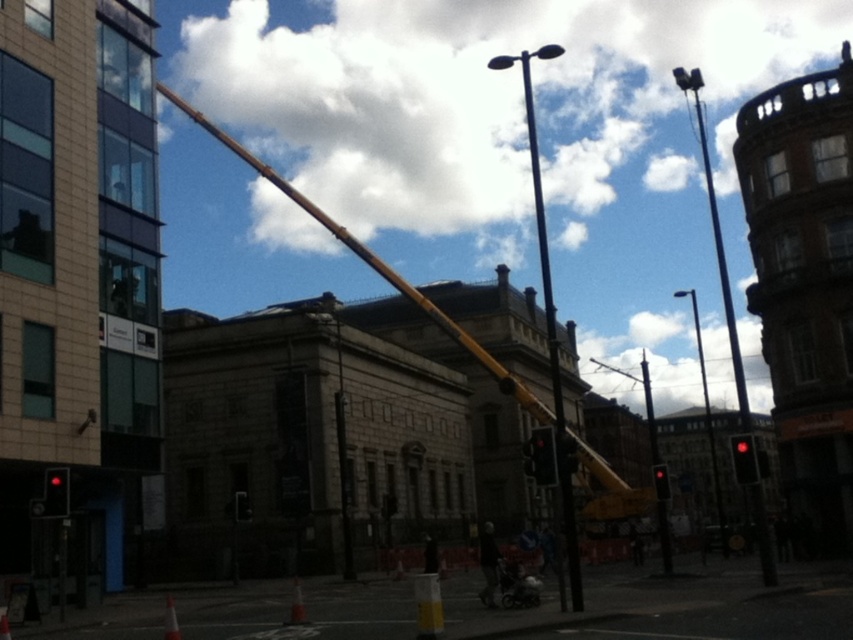
Is point (547, 264) farther from camera compared to point (643, 396)?

No, (547, 264) is closer to viewer.

Is polished metal pole at center bigger than metallic traffic light at center?

Yes.

This screenshot has height=640, width=853. What do you see at coordinates (550, 328) in the screenshot? I see `polished metal pole at center` at bounding box center [550, 328].

The height and width of the screenshot is (640, 853). In order to click on polished metal pole at center in this screenshot , I will do `click(550, 328)`.

Which is in front, point (650, 429) or point (167, 600)?

Point (167, 600) is more forward.

Is point (665, 536) behind point (167, 604)?

That is False.

Locate an element on the screen. The height and width of the screenshot is (640, 853). metallic traffic light at center is located at coordinates (664, 534).

The height and width of the screenshot is (640, 853). What do you see at coordinates (549, 320) in the screenshot? I see `polished metal street light at center` at bounding box center [549, 320].

Where is `polished metal street light at center`? polished metal street light at center is located at coordinates (549, 320).

Which is behind, point (488, 67) or point (540, 477)?

The point (488, 67) is behind.

Image resolution: width=853 pixels, height=640 pixels. In order to click on polished metal street light at center in this screenshot , I will do `click(549, 320)`.